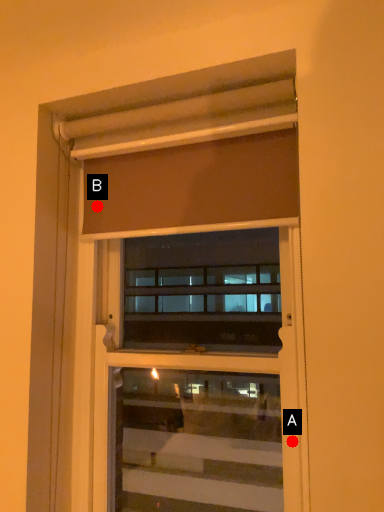
Question: Two points are circled on the image, labeled by A and B beside each circle. Which point appears closest to the camera in this image?

Choices:
 (A) A is closer
 (B) B is closer

Answer: (A)